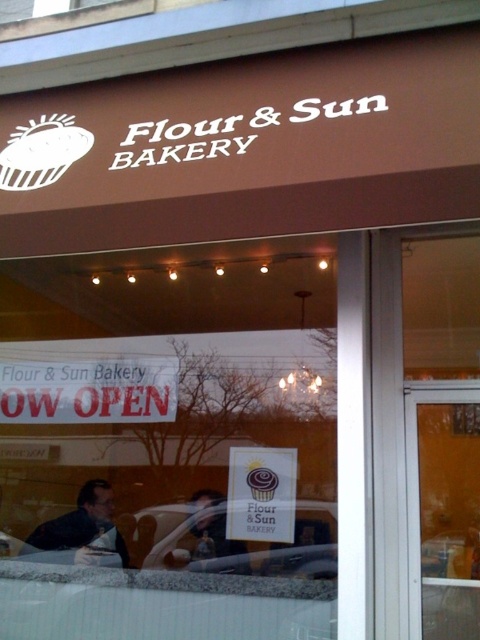
Question: Does dark brown hair at lower left come behind matte black shirt at center?

Choices:
 (A) no
 (B) yes

Answer: (B)

Question: Can you confirm if dark brown hair at lower left is positioned to the left of matte black shirt at center?

Choices:
 (A) no
 (B) yes

Answer: (B)

Question: Among these points, which one is nearest to the camera?

Choices:
 (A) (39, 529)
 (B) (214, 556)

Answer: (B)

Question: Which object is closer to the camera taking this photo?

Choices:
 (A) matte black shirt at center
 (B) dark brown hair at lower left
 (C) clear glass car at center

Answer: (A)

Question: Based on their relative distances, which object is farther from the matte black shirt at center?

Choices:
 (A) clear glass car at center
 (B) dark brown hair at lower left

Answer: (B)

Question: Does dark brown hair at lower left have a greater width compared to matte black shirt at center?

Choices:
 (A) yes
 (B) no

Answer: (A)